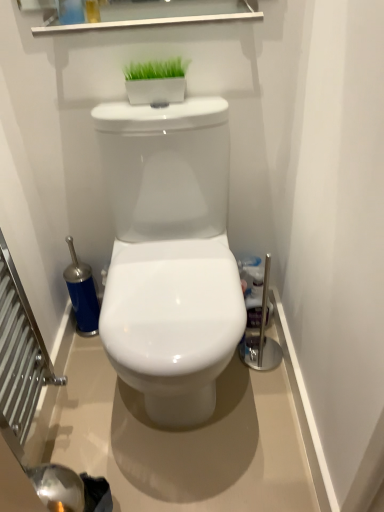
You are a GUI agent. You are given a task and a screenshot of the screen. Output one action in this format:
    pyautogui.click(x=<x>, y=<y>)
    Task: Click on the free space underneath brushed metal medicine cabinet at upper center (from a real-world perspective)
    
    Given the screenshot: What is the action you would take?
    pyautogui.click(x=157, y=105)